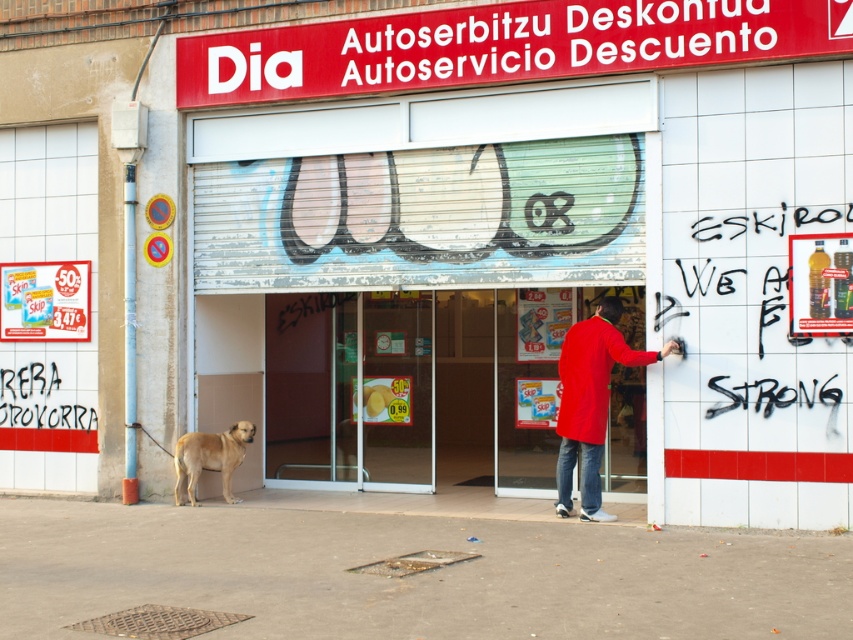
You are a delivery person who needs to enter the Dia store through the entrance. The black graffiti at right and the matte red coat at center are in your line of sight. Which object is larger in size?

The black graffiti at right is bigger than the matte red coat at center, so the black graffiti at right is larger in size.

You are standing at the entrance of the Dia store. You need to locate the metallic silver door at center. Where is it positioned relative to the store entrance?

The metallic silver door at center is positioned at point (416, 273) relative to the store entrance.

You are a customer entering the Dia store and notice two items near the entrance. You see the black graffiti at right and the matte red coat at center. Which one do you have to look up to see?

The black graffiti at right has a greater height compared to the matte red coat at center, so you have to look up to see the black graffiti at right.